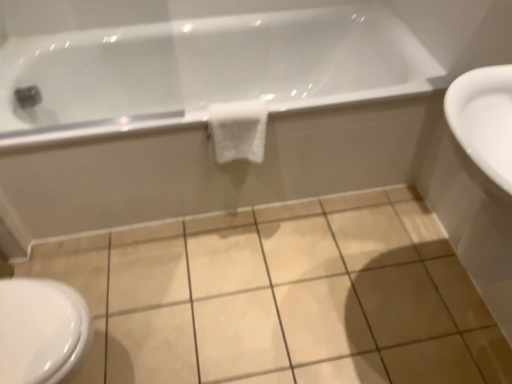
Question: From a real-world perspective, is white glossy bathtub at upper center positioned over white glossy sink at right based on gravity?

Choices:
 (A) yes
 (B) no

Answer: (B)

Question: Are white glossy bathtub at upper center and white glossy sink at right far apart?

Choices:
 (A) no
 (B) yes

Answer: (A)

Question: Is white glossy bathtub at upper center facing towards white glossy sink at right?

Choices:
 (A) no
 (B) yes

Answer: (B)

Question: Does white glossy bathtub at upper center appear on the right side of white glossy sink at right?

Choices:
 (A) no
 (B) yes

Answer: (A)

Question: Is white glossy bathtub at upper center further to camera compared to white glossy sink at right?

Choices:
 (A) no
 (B) yes

Answer: (B)

Question: From the image's perspective, is white glossy bathtub at upper center below white glossy sink at right?

Choices:
 (A) no
 (B) yes

Answer: (A)

Question: Is white glossy bidet at lower left completely or partially outside of white glossy sink at right?

Choices:
 (A) yes
 (B) no

Answer: (A)

Question: Considering the relative sizes of white glossy bidet at lower left and white glossy sink at right in the image provided, is white glossy bidet at lower left thinner than white glossy sink at right?

Choices:
 (A) no
 (B) yes

Answer: (B)

Question: From a real-world perspective, is white glossy bidet at lower left on top of white glossy sink at right?

Choices:
 (A) no
 (B) yes

Answer: (A)

Question: Is white glossy bidet at lower left touching white glossy sink at right?

Choices:
 (A) no
 (B) yes

Answer: (A)

Question: Does white glossy bidet at lower left lie behind white glossy sink at right?

Choices:
 (A) yes
 (B) no

Answer: (A)

Question: From a real-world perspective, does white glossy bidet at lower left sit lower than white glossy sink at right?

Choices:
 (A) yes
 (B) no

Answer: (A)

Question: Does beige ceramic tile at center have a greater width compared to white glossy sink at right?

Choices:
 (A) yes
 (B) no

Answer: (A)